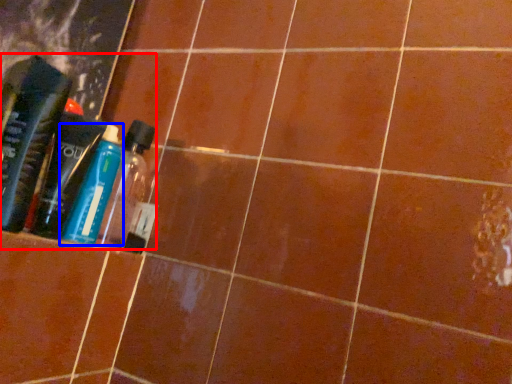
Question: Which point is closer to the camera, product (highlighted by a red box) or bottle (highlighted by a blue box)?

Choices:
 (A) product
 (B) bottle

Answer: (B)